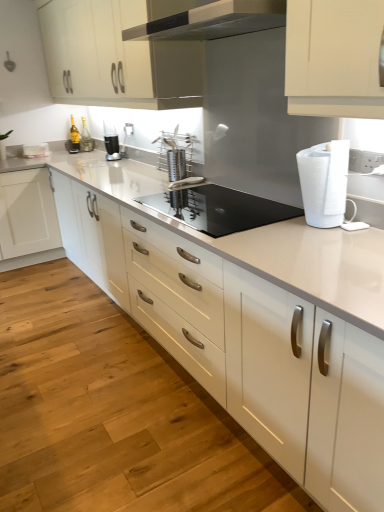
Question: Can you confirm if satin silver utensil holder at center, the first appliance in the top-to-bottom sequence, is taller than black glass cooktop at center, which is the 2th appliance in top-to-bottom order?

Choices:
 (A) no
 (B) yes

Answer: (B)

Question: Does satin silver utensil holder at center, the second appliance from the bottom, appear on the left side of black glass cooktop at center, the first appliance when ordered from bottom to top?

Choices:
 (A) yes
 (B) no

Answer: (A)

Question: Is satin silver utensil holder at center, the second appliance from the bottom, far from black glass cooktop at center, which is the 2th appliance in top-to-bottom order?

Choices:
 (A) yes
 (B) no

Answer: (B)

Question: Can black glass cooktop at center, the second appliance from the back, be found inside satin silver utensil holder at center, marked as the first appliance in a back-to-front arrangement?

Choices:
 (A) no
 (B) yes

Answer: (A)

Question: Is satin silver utensil holder at center, the first appliance in the top-to-bottom sequence, bigger than black glass cooktop at center, the second appliance from the back?

Choices:
 (A) yes
 (B) no

Answer: (B)

Question: Is satin silver utensil holder at center, marked as the first appliance in a back-to-front arrangement, smaller than black glass cooktop at center, the 1th appliance from the front?

Choices:
 (A) yes
 (B) no

Answer: (A)

Question: Is matte white cabinets at upper center not within white plastic paper towel at right?

Choices:
 (A) yes
 (B) no

Answer: (A)

Question: Is matte white cabinets at upper center placed right next to white plastic paper towel at right?

Choices:
 (A) no
 (B) yes

Answer: (A)

Question: Can white plastic paper towel at right be found inside matte white cabinets at upper center?

Choices:
 (A) yes
 (B) no

Answer: (B)

Question: Can you confirm if matte white cabinets at upper center is bigger than white plastic paper towel at right?

Choices:
 (A) no
 (B) yes

Answer: (B)

Question: Is the depth of matte white cabinets at upper center less than that of white plastic paper towel at right?

Choices:
 (A) yes
 (B) no

Answer: (B)

Question: Are matte white cabinets at upper center and white plastic paper towel at right far apart?

Choices:
 (A) no
 (B) yes

Answer: (B)

Question: Does white glossy countertop at center lie in front of satin silver utensil holder at center, the first appliance in the top-to-bottom sequence?

Choices:
 (A) yes
 (B) no

Answer: (A)